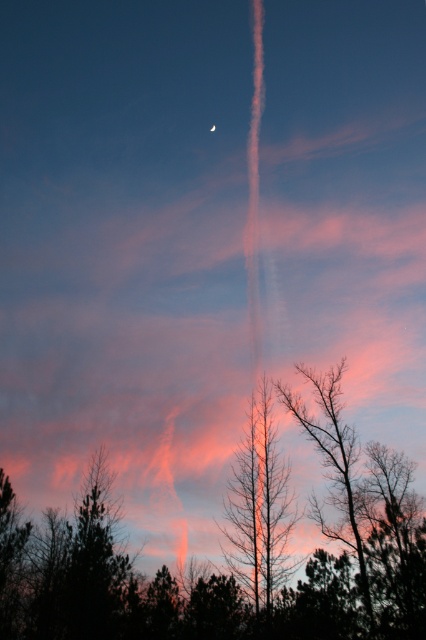
You are an artist sketching the scene and want to draw the relationship between the two sets of bare branches. According to the image, where is the bare branches at center in relation to the bare branches at lower right?

The bare branches at center are to the left of the bare branches at lower right.

You are an artist sketching the scene and want to emphasize the contrast between the two central elements. Which object should you draw first to establish the scale of the composition, the silhouette bare tree at center or the bare branches at center?

The silhouette bare tree at center should be drawn first because it has a larger size compared to the bare branches at center, establishing the scale of the composition.

You are standing in a field looking at the twilight sky. You notice a point at coordinates (259, 509). What is located at that point?

At point (259, 509) lies bare branches at center.